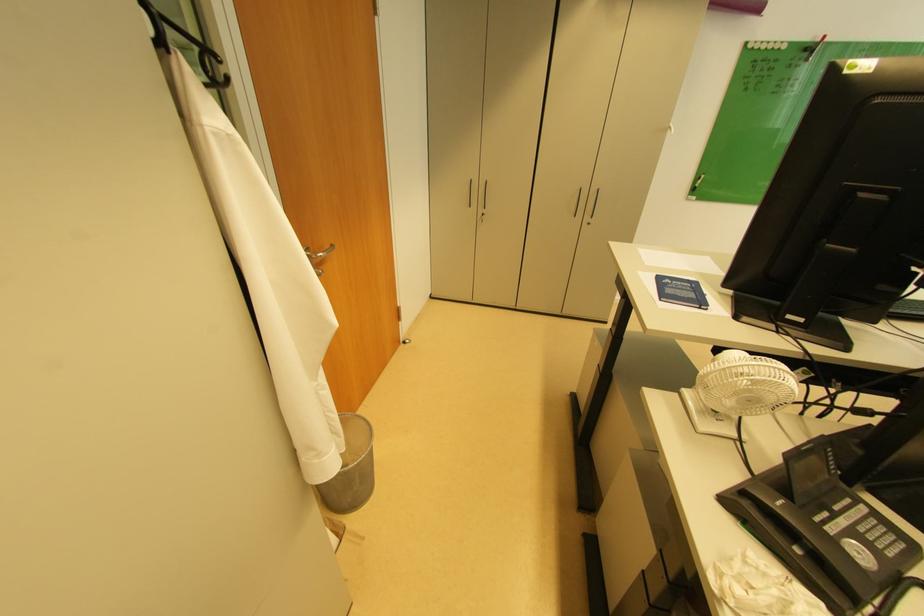
Find where to turn the metal door handle. Please return your answer as a coordinate pair (x, y).

(319, 254)